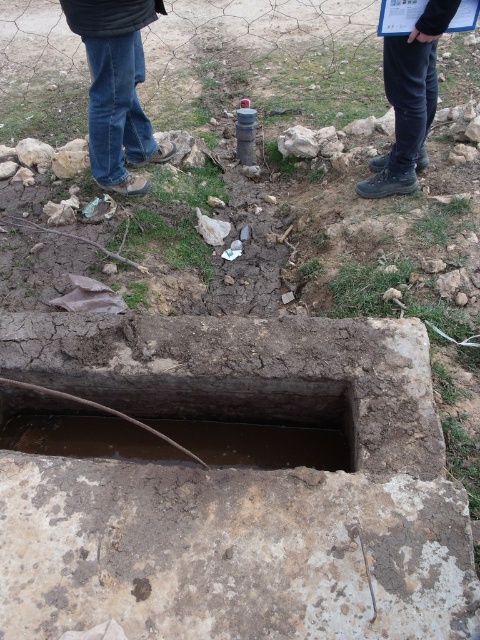
Which is below, brown concrete hole at center or jeans at center?

brown concrete hole at center is lower down.

Can you confirm if brown concrete hole at center is positioned to the left of jeans at center?

Incorrect, brown concrete hole at center is not on the left side of jeans at center.

At what (x,y) coordinates should I click in order to perform the action: click on brown concrete hole at center. Please return your answer as a coordinate pair (x, y). This screenshot has height=640, width=480. Looking at the image, I should click on (170, 436).

Locate an element on the screen. The image size is (480, 640). brown concrete hole at center is located at coordinates (170, 436).

Between point (112, 186) and point (394, 186), which one is positioned in front?

Positioned in front is point (394, 186).

Who is taller, jeans at center or black leather pants at upper right?

jeans at center

Is point (122, 64) positioned before point (396, 44)?

No, it is behind (396, 44).

Find the location of a particular element. This screenshot has width=480, height=640. jeans at center is located at coordinates (117, 88).

Does brown concrete hole at center appear on the left side of black leather pants at upper right?

Correct, you'll find brown concrete hole at center to the left of black leather pants at upper right.

Does brown concrete hole at center have a greater height compared to black leather pants at upper right?

Incorrect, brown concrete hole at center's height is not larger of black leather pants at upper right's.

At what (x,y) coordinates should I click in order to perform the action: click on brown concrete hole at center. Please return your answer as a coordinate pair (x, y). Looking at the image, I should click on (170, 436).